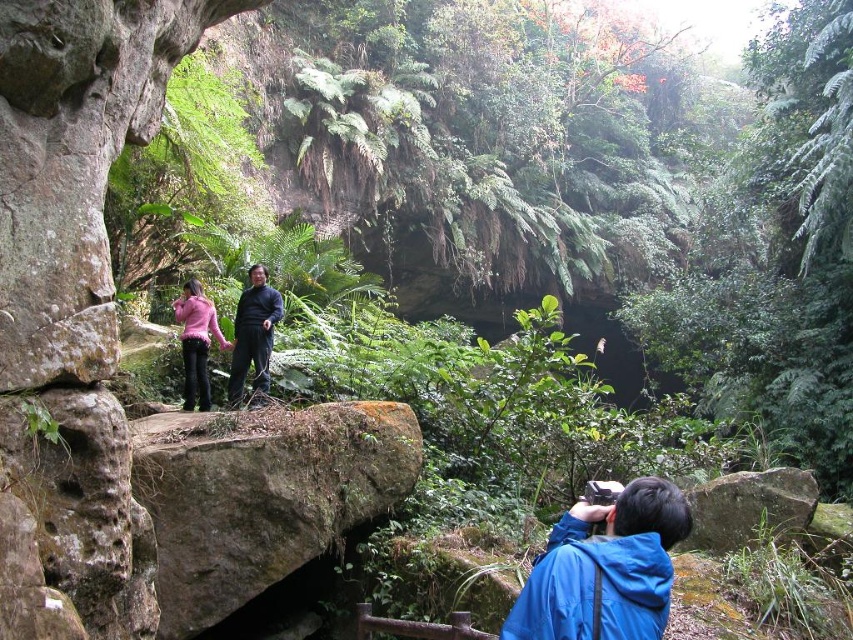
You are a photographer standing in a lush cave entrance with dense vegetation. You are wearing a blue fabric jacket at lower right and holding a camera. If you want to take a photo of the entire scene without moving your body, will your jacket be in the frame?

The blue fabric jacket at lower right is 3.19 meters from the camera. Since the jacket is positioned at a distance from the camera, it is likely outside the frame unless the camera has an extremely wide angle lens. Therefore, the jacket may not appear in the photo if the camera is set to capture the broader scene.

You are standing in a lush natural setting with a photographer on the right side holding a camera. You notice two points marked in the scene. Which point, point [693,488] or point [177,308], is nearer to you?

Point [693,488] is closer to the viewer than point [177,308].

You are a photographer standing in the lush natural setting described. You notice the smooth gray rock at lower right and the pink fleece jacket at center. Which object is closer to you, the photographer?

The smooth gray rock at lower right is closer to you because it is in front of the pink fleece jacket at center.